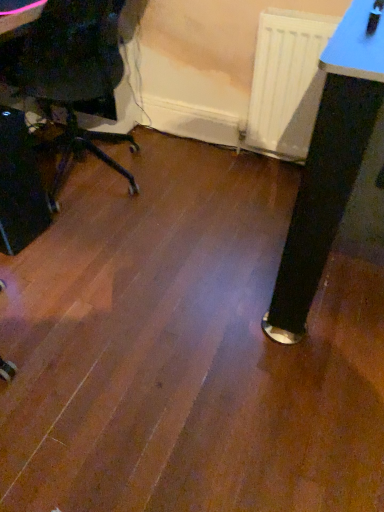
Locate an element on the screen. The width and height of the screenshot is (384, 512). empty space that is to the right of black plastic computer tower at left is located at coordinates (74, 236).